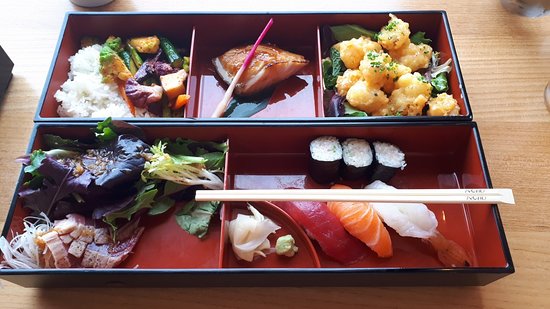
At what (x,y) coordinates should I click in order to perform the action: click on semi circle divider. Please return your answer as a coordinate pair (x, y). Looking at the image, I should click on (277, 207).